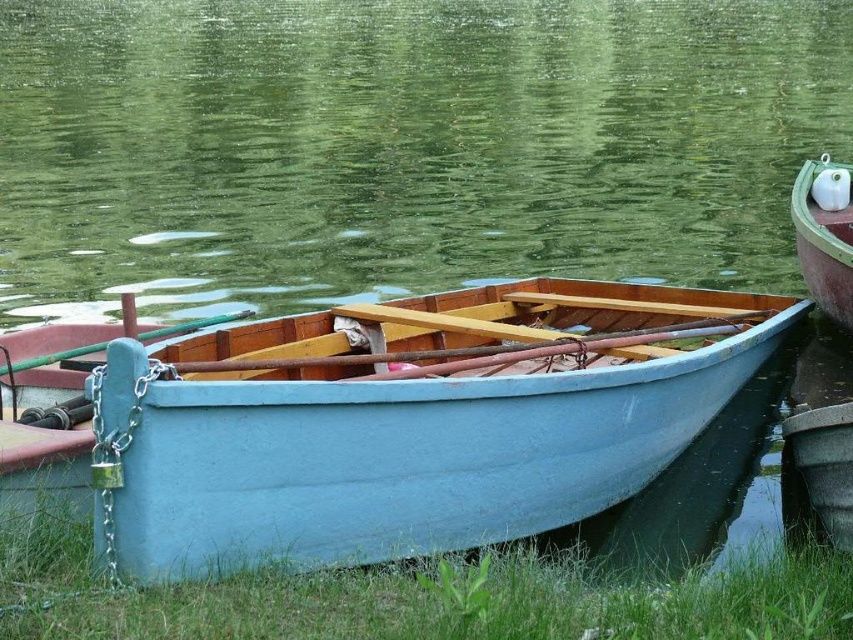
Does light blue wood boat at center appear under green grass at lower center?

Actually, light blue wood boat at center is above green grass at lower center.

Who is more forward, (x=674, y=401) or (x=399, y=621)?

Point (x=399, y=621) is in front.

Find the location of a particular element. light blue wood boat at center is located at coordinates (408, 420).

Is green water at center bigger than green wooden boat at right?

Indeed, green water at center has a larger size compared to green wooden boat at right.

Is green water at center closer to the viewer compared to green wooden boat at right?

That is False.

Is point (779, 216) less distant than point (795, 177)?

That is True.

Where is `green water at center`? green water at center is located at coordinates (402, 147).

Is green water at center wider than light blue wood boat at center?

Indeed, green water at center has a greater width compared to light blue wood boat at center.

Between green water at center and light blue wood boat at center, which one is positioned lower?

light blue wood boat at center

Between point (466, 120) and point (412, 483), which one is positioned in front?

Point (412, 483)

The height and width of the screenshot is (640, 853). What are the coordinates of `green water at center` in the screenshot? It's located at [x=402, y=147].